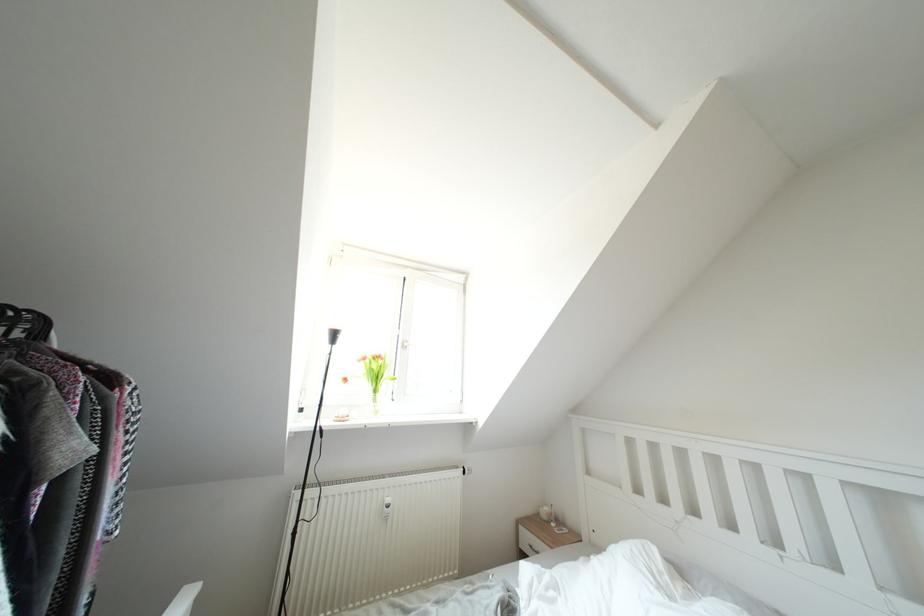
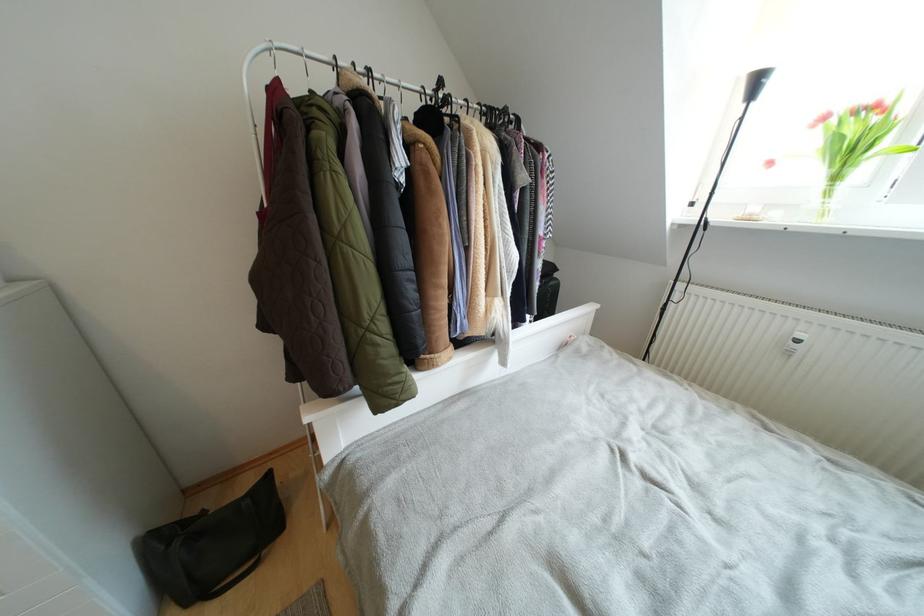
The point at (381, 395) is marked in the first image. Where is the corresponding point in the second image?

(840, 182)